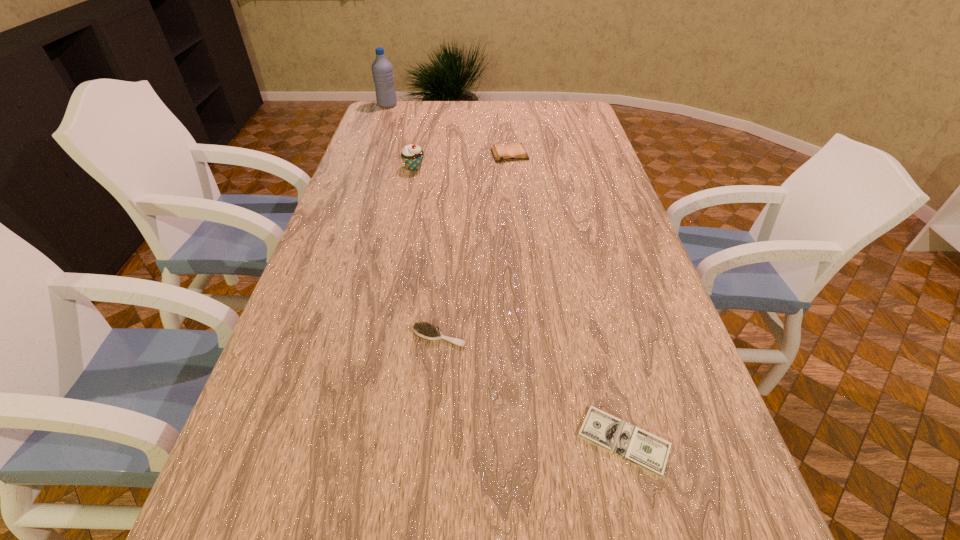
Identify the location of the tallest object. This screenshot has height=540, width=960. (382, 70).

You are a GUI agent. You are given a task and a screenshot of the screen. Output one action in this format:
    pyautogui.click(x=<x>, y=<y>)
    Task: Click on the farthest object
    This screenshot has height=540, width=960.
    Given the screenshot: What is the action you would take?
    pyautogui.click(x=382, y=70)

Locate an element on the screen. This screenshot has height=540, width=960. the second object from left to right is located at coordinates (412, 155).

What are the coordinates of `the fourth shortest object` in the screenshot? It's located at (412, 155).

This screenshot has height=540, width=960. Find the location of `the fourth object from left to right`. the fourth object from left to right is located at coordinates (515, 151).

What are the coordinates of `scrubbing brush` in the screenshot? It's located at (425, 330).

In order to click on the fourth farthest object in this screenshot , I will do `click(425, 330)`.

This screenshot has width=960, height=540. I want to click on the shortest object, so tap(641, 448).

Locate an element on the screen. The height and width of the screenshot is (540, 960). the nearest object is located at coordinates (641, 448).

At what (x,y) coordinates should I click in order to perform the action: click on vacant space located 0.180m on the front of the farthest object. Please return your answer as a coordinate pair (x, y). This screenshot has width=960, height=540. Looking at the image, I should click on (379, 128).